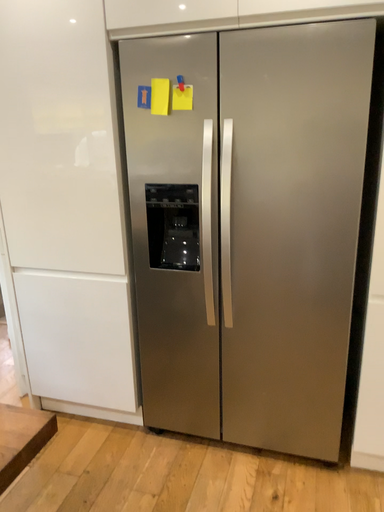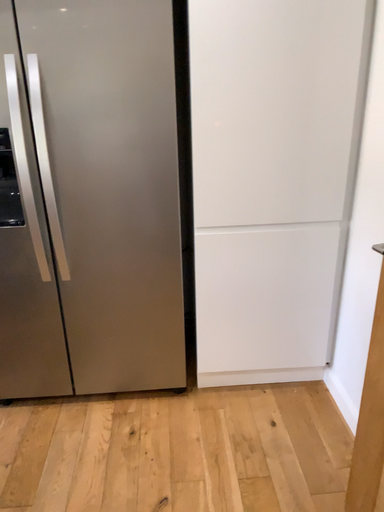
Question: Which way did the camera rotate in the video?

Choices:
 (A) rotated right
 (B) rotated left

Answer: (A)